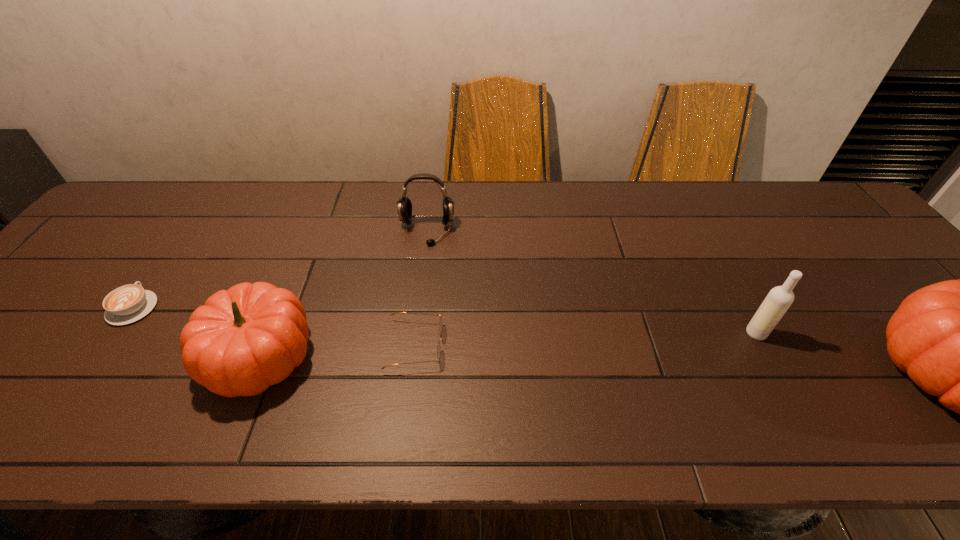
Find the location of a particular element. free space at the right edge is located at coordinates (897, 292).

Find the location of a particular element. This screenshot has height=540, width=960. blank space at the far left corner is located at coordinates (162, 215).

Locate an element on the screen. This screenshot has height=540, width=960. vacant space at the far right corner is located at coordinates (838, 227).

The image size is (960, 540). Identify the location of free space that is in between the shortest object and the farthest object. (280, 269).

At what (x,y) coordinates should I click in order to perform the action: click on unoccupied area between the spectacles and the headset. Please return your answer as a coordinate pair (x, y). Image resolution: width=960 pixels, height=540 pixels. Looking at the image, I should click on (421, 288).

What are the coordinates of `object that stands as the fourth closest to the spectacles` in the screenshot? It's located at (779, 299).

I want to click on object that is the second closest to the farthest object, so 244,339.

What are the coordinates of `vacant space that satisfies the following two spatial constraints: 1. with the microphone on the side of the second object from right to left; 2. on the right side of the headset` in the screenshot? It's located at (414, 333).